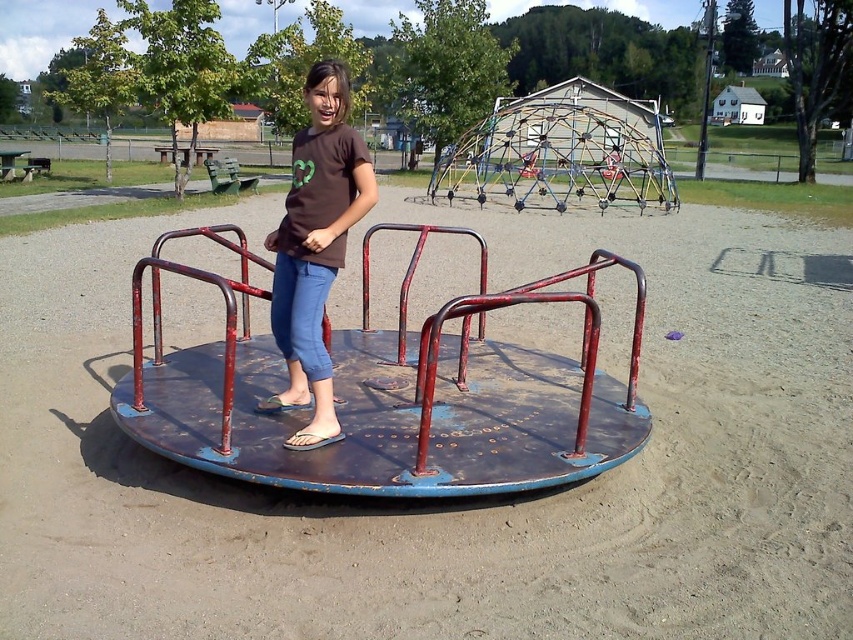
What do you see at coordinates (390, 392) in the screenshot? I see `rusty metal carousel at center` at bounding box center [390, 392].

Can you confirm if rusty metal carousel at center is shorter than brown matte shirt at center?

No.

The height and width of the screenshot is (640, 853). I want to click on rusty metal carousel at center, so click(x=390, y=392).

Where is `rusty metal carousel at center`? The width and height of the screenshot is (853, 640). rusty metal carousel at center is located at coordinates tap(390, 392).